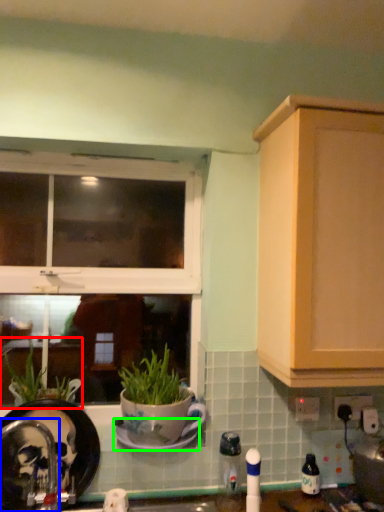
Question: Estimate the real-world distances between objects in this image. Which object is closer to houseplant (highlighted by a red box), faucet (highlighted by a blue box) or saucer (highlighted by a green box)?

Choices:
 (A) faucet
 (B) saucer

Answer: (A)